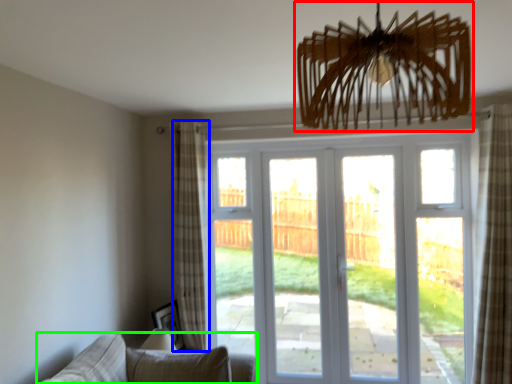
Question: Which object is positioned farthest from chandelier (highlighted by a red box)? Select from curtain (highlighted by a blue box) and studio couch (highlighted by a green box).

Choices:
 (A) curtain
 (B) studio couch

Answer: (A)